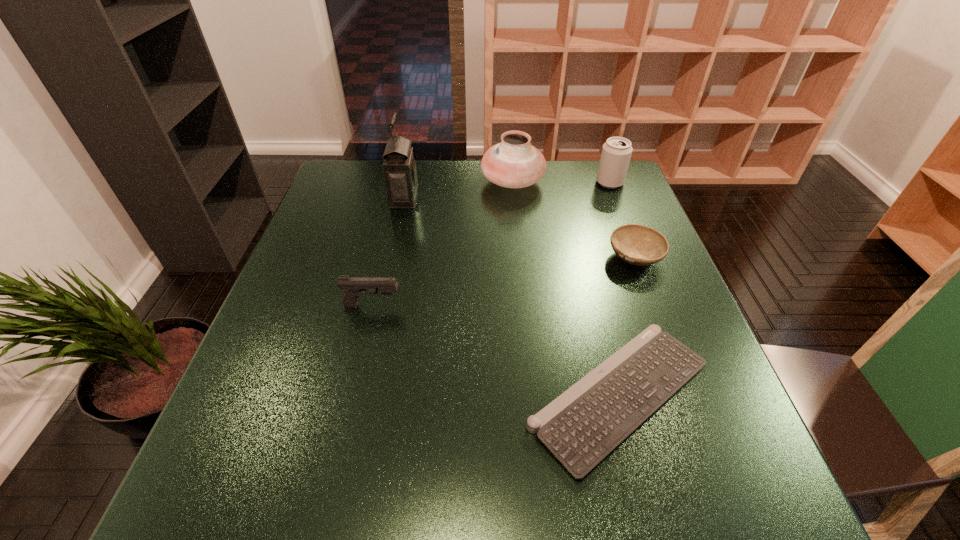
At what (x,y) coordinates should I click in order to perform the action: click on empty space between the pistol and the pottery. Please return your answer as a coordinate pair (x, y). Looking at the image, I should click on (443, 244).

At what (x,y) coordinates should I click in order to perform the action: click on object that is the closest to the lantern. Please return your answer as a coordinate pair (x, y). The width and height of the screenshot is (960, 540). Looking at the image, I should click on (514, 163).

Choose which object is the third nearest neighbor to the pottery. Please provide its 2D coordinates. Your answer should be formatted as a tuple, i.e. [(x, y)], where the tuple contains the x and y coordinates of a point satisfying the conditions above.

[(639, 245)]

Locate an element on the screen. This screenshot has width=960, height=540. free space that satisfies the following two spatial constraints: 1. on the front side of the second shortest object; 2. at the barrel of the pistol is located at coordinates (653, 306).

At what (x,y) coordinates should I click in order to perform the action: click on vacant area in the image that satisfies the following two spatial constraints: 1. at the barrel of the computer keyboard; 2. on the left side of the pistol. Please return your answer as a coordinate pair (x, y). The height and width of the screenshot is (540, 960). Looking at the image, I should click on (351, 394).

You are a GUI agent. You are given a task and a screenshot of the screen. Output one action in this format:
    pyautogui.click(x=<x>, y=<y>)
    Task: Click on the vacant space that satisfies the following two spatial constraints: 1. on the front side of the nearest object; 2. on the left side of the pottery
    
    Given the screenshot: What is the action you would take?
    pyautogui.click(x=534, y=394)

You are a GUI agent. You are given a task and a screenshot of the screen. Output one action in this format:
    pyautogui.click(x=<x>, y=<y>)
    Task: Click on the vacant space that satisfies the following two spatial constraints: 1. on the back side of the can; 2. on the left side of the bowl
    
    Given the screenshot: What is the action you would take?
    pyautogui.click(x=607, y=183)

Find the location of a particular element. The width and height of the screenshot is (960, 540). blank area in the image that satisfies the following two spatial constraints: 1. on the front side of the can; 2. on the right side of the pottery is located at coordinates (513, 183).

Locate an element on the screen. This screenshot has height=540, width=960. vacant space that satisfies the following two spatial constraints: 1. on the back side of the nearest object; 2. at the barrel of the pistol is located at coordinates (597, 306).